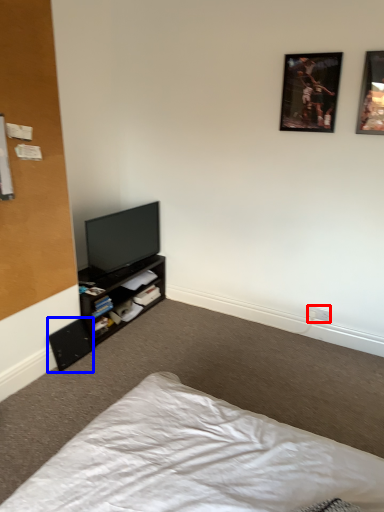
Question: Which of the following is the farthest to the observer, electric outlet (highlighted by a red box) or speaker (highlighted by a blue box)?

Choices:
 (A) electric outlet
 (B) speaker

Answer: (A)